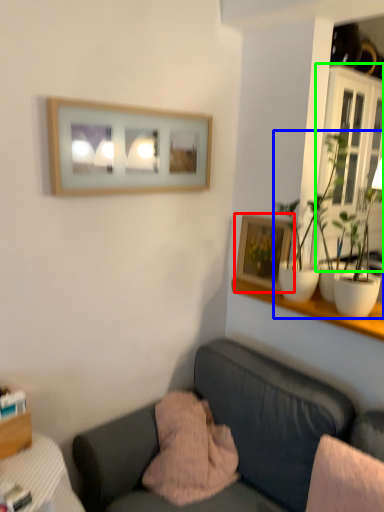
Question: Which is farther away from picture frame (highlighted by a red box)? houseplant (highlighted by a blue box) or window frame (highlighted by a green box)?

Choices:
 (A) houseplant
 (B) window frame

Answer: (B)